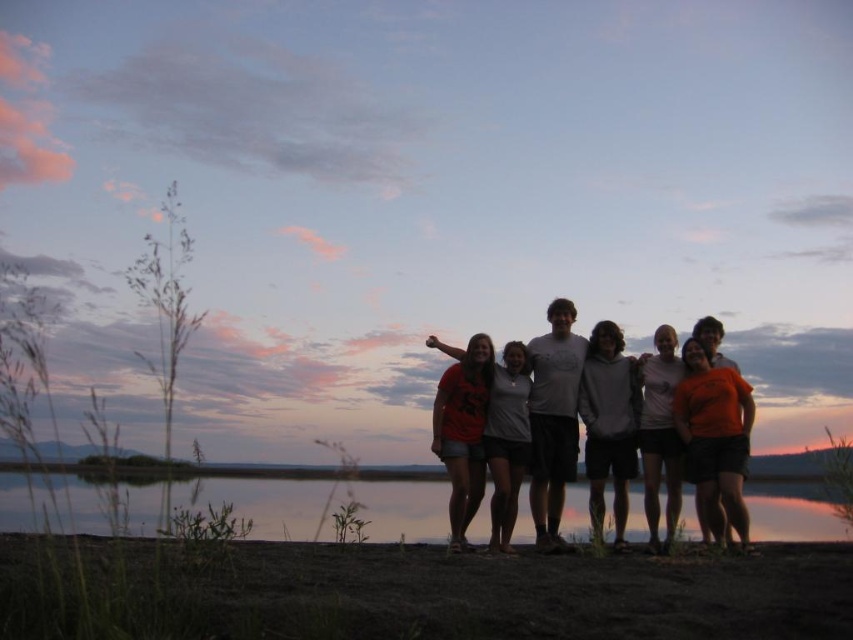
Who is higher up, gray hoodie at center or orange cotton shirt at center?

Positioned higher is gray hoodie at center.

Is gray hoodie at center positioned in front of orange cotton shirt at center?

No, gray hoodie at center is further to the viewer.

Identify the location of gray hoodie at center. (608, 424).

Identify the location of gray hoodie at center. The height and width of the screenshot is (640, 853). (608, 424).

Can you confirm if orange matte shirt at center is positioned above gray hoodie at center?

Actually, orange matte shirt at center is below gray hoodie at center.

Does orange matte shirt at center lie in front of gray hoodie at center?

Yes, it is in front of gray hoodie at center.

Image resolution: width=853 pixels, height=640 pixels. In order to click on orange matte shirt at center in this screenshot , I will do [715, 436].

Where is `orange matte shirt at center`? orange matte shirt at center is located at coordinates [x=715, y=436].

Who is positioned more to the right, transparent water at lower center or orange matte shirt at center?

orange matte shirt at center

From the picture: Is transparent water at lower center wider than orange matte shirt at center?

Correct, the width of transparent water at lower center exceeds that of orange matte shirt at center.

Which is in front, point (62, 515) or point (677, 424)?

Point (62, 515) is in front.

You are a GUI agent. You are given a task and a screenshot of the screen. Output one action in this format:
    pyautogui.click(x=<x>, y=<y>)
    Task: Click on the transparent water at lower center
    
    Given the screenshot: What is the action you would take?
    pyautogui.click(x=260, y=502)